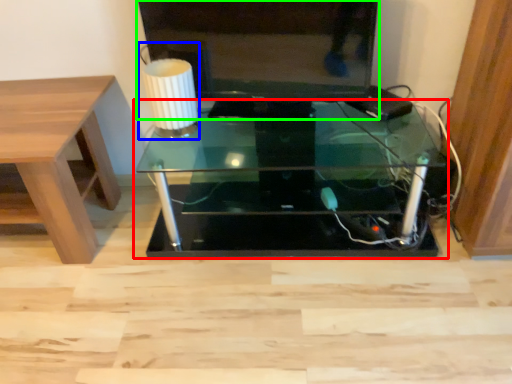
Question: Based on their relative distances, which object is farther from table (highlighted by a red box)? Choose from table lamp (highlighted by a blue box) and television (highlighted by a green box).

Choices:
 (A) table lamp
 (B) television

Answer: (A)